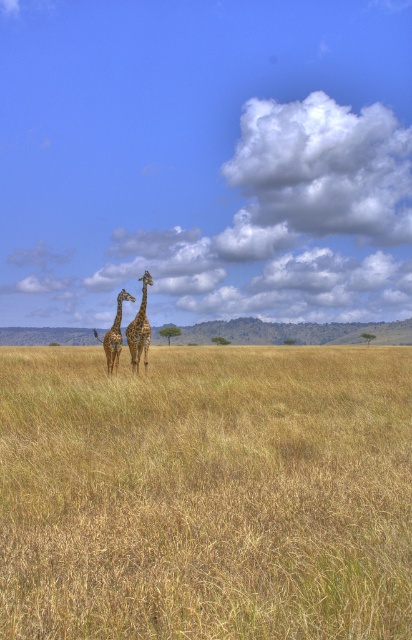
Can you confirm if dry grass at center is shorter than brown textured giraffe at center?

Yes.

This screenshot has height=640, width=412. What do you see at coordinates (206, 493) in the screenshot?
I see `dry grass at center` at bounding box center [206, 493].

Locate an element on the screen. The height and width of the screenshot is (640, 412). dry grass at center is located at coordinates (206, 493).

Can you confirm if dry grass at center is bigger than spotted brown giraffe at center?

Indeed, dry grass at center has a larger size compared to spotted brown giraffe at center.

Does dry grass at center lie behind spotted brown giraffe at center?

No, it is in front of spotted brown giraffe at center.

Which is in front, point (215, 449) or point (149, 273)?

Point (215, 449) is more forward.

Locate an element on the screen. dry grass at center is located at coordinates (206, 493).

Find the location of a particular element. spotted brown giraffe at center is located at coordinates (140, 328).

Which is in front, point (142, 308) or point (131, 296)?

Point (142, 308) is more forward.

The width and height of the screenshot is (412, 640). Find the location of `spotted brown giraffe at center`. spotted brown giraffe at center is located at coordinates (140, 328).